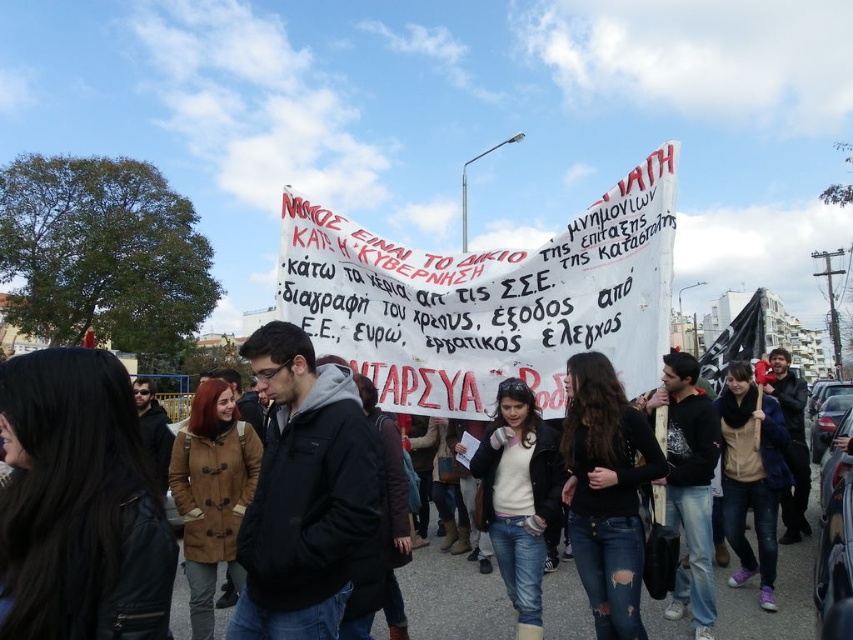
Where is the white paper banner at center located in the image?

The white paper banner at center is located at point coordinates (486,300).